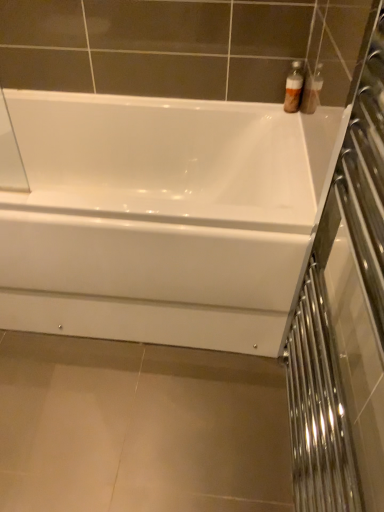
In order to click on free region on the left part of translucent plastic bottles at upper right in this screenshot , I will do `click(254, 112)`.